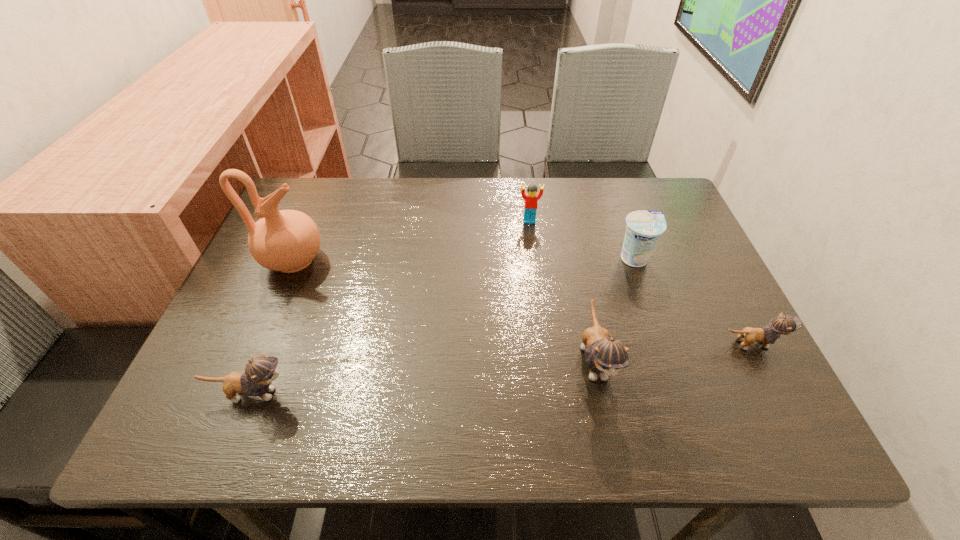
The width and height of the screenshot is (960, 540). Identify the location of vacant space situated 0.250m on the face of the Lego. (539, 292).

Where is `free space located on the spout of the tallest object`? free space located on the spout of the tallest object is located at coordinates (450, 261).

You are a GUI agent. You are given a task and a screenshot of the screen. Output one action in this format:
    pyautogui.click(x=<x>, y=<y>)
    Task: Click on the vacant space located 0.340m on the left of the second object from right to left
    Image resolution: width=960 pixels, height=540 pixels.
    Given the screenshot: What is the action you would take?
    pyautogui.click(x=480, y=259)

This screenshot has height=540, width=960. Find the location of `object present at the far edge`. object present at the far edge is located at coordinates (531, 198).

This screenshot has width=960, height=540. Find the location of `kitten located in the left edge section of the desktop`. kitten located in the left edge section of the desktop is located at coordinates (259, 373).

Where is `pottery that is at the left edge`? pottery that is at the left edge is located at coordinates (287, 240).

Find the location of a particular element. kitten present at the right edge is located at coordinates (782, 324).

This screenshot has height=540, width=960. Find the location of `yogurt at the right edge`. yogurt at the right edge is located at coordinates (644, 227).

Identify the location of object that is positioned at the near left corner. (259, 373).

Identify the location of vacant space at the far edge of the desktop. Image resolution: width=960 pixels, height=540 pixels. (348, 205).